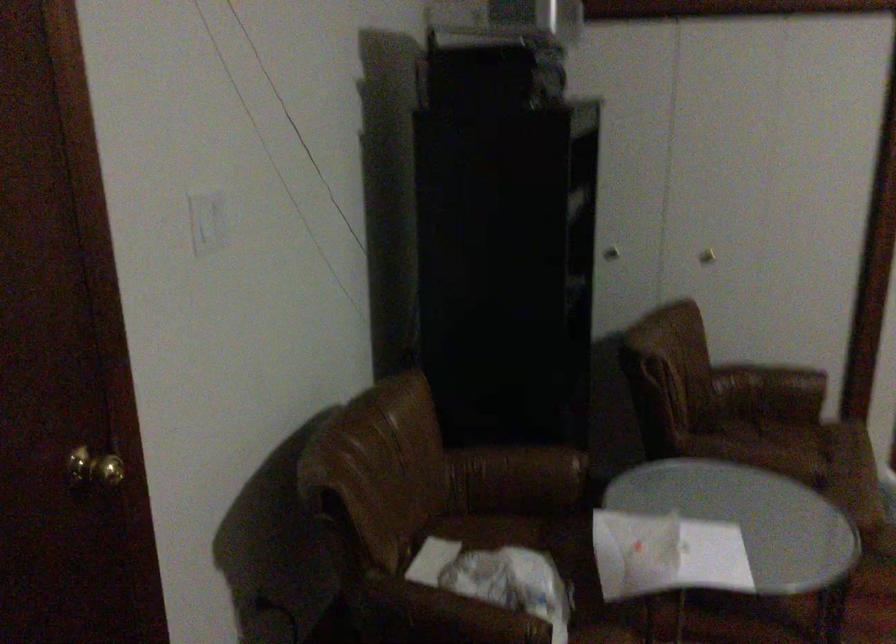
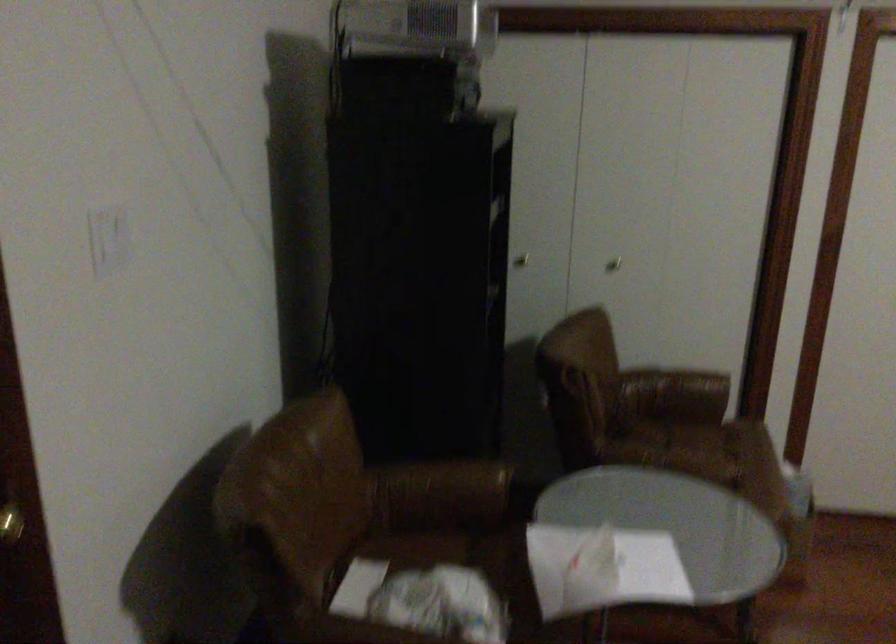
In the second image, find the point that corresponds to (x=517, y=471) in the first image.

(442, 488)